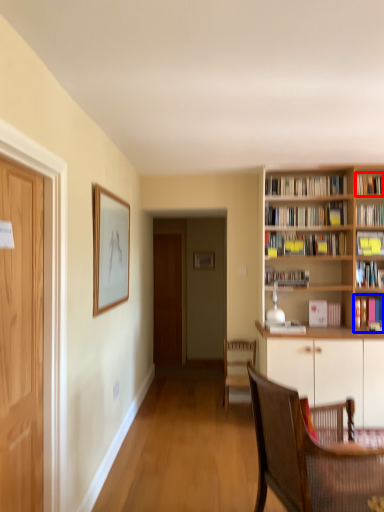
Question: Which object appears closest to the camera in this image, book (highlighted by a red box) or book (highlighted by a blue box)?

Choices:
 (A) book
 (B) book

Answer: (B)